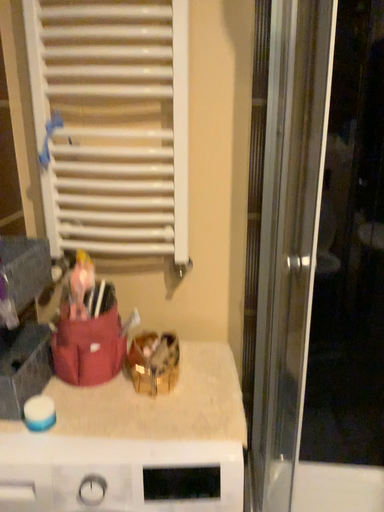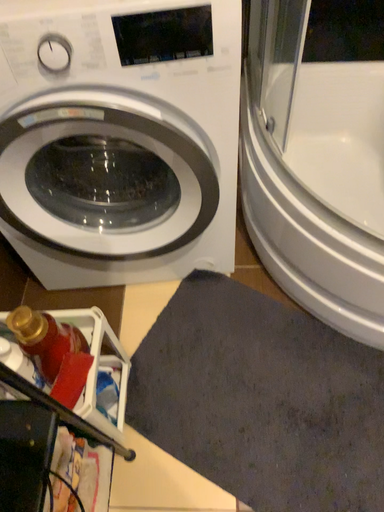
Question: How did the camera likely rotate when shooting the video?

Choices:
 (A) rotated upward
 (B) rotated downward

Answer: (B)